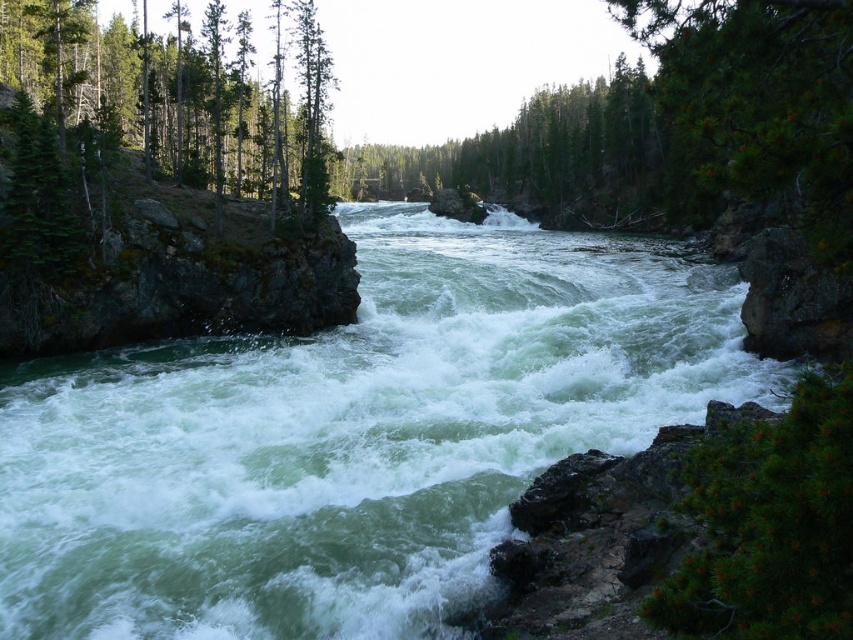
Question: Is green smooth water at center further to the viewer compared to green matte tree at left?

Choices:
 (A) no
 (B) yes

Answer: (A)

Question: Which object is closer to the camera taking this photo?

Choices:
 (A) green smooth water at center
 (B) green matte tree at left

Answer: (A)

Question: Which of the following is the closest to the observer?

Choices:
 (A) green smooth water at center
 (B) green matte tree at left

Answer: (A)

Question: Is green smooth water at center in front of green matte tree at left?

Choices:
 (A) no
 (B) yes

Answer: (B)

Question: Is green smooth water at center to the left of green matte tree at left from the viewer's perspective?

Choices:
 (A) no
 (B) yes

Answer: (A)